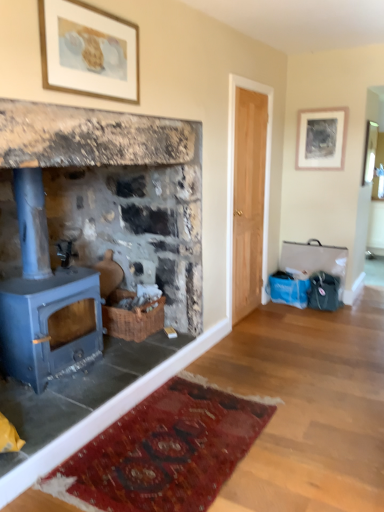
Looking at this image, what is the approximate height of matte silver picture frame at upper right, the 2th picture frame positioned from the front?

The height of matte silver picture frame at upper right, the 2th picture frame positioned from the front, is 55.64 centimeters.

Locate an element on the screen. This screenshot has width=384, height=512. blue painted wood stove at left is located at coordinates (94, 262).

Identify the location of matte blue wood burning stove at left. This screenshot has height=512, width=384. (46, 300).

Describe the element at coordinates (88, 51) in the screenshot. This screenshot has height=512, width=384. I see `gold-framed artwork at upper center, placed as the second picture frame when sorted from right to left` at that location.

Where is `matte silver picture frame at upper right, which is the 1th picture frame in back-to-front order`? This screenshot has height=512, width=384. matte silver picture frame at upper right, which is the 1th picture frame in back-to-front order is located at coordinates (321, 139).

From a real-world perspective, is matte silver picture frame at upper right, which is the 1th picture frame in back-to-front order, located beneath blue painted wood stove at left?

No, from a real-world perspective, matte silver picture frame at upper right, which is the 1th picture frame in back-to-front order, is not below blue painted wood stove at left.

Looking at this image, between matte silver picture frame at upper right, the first picture frame positioned from the right, and blue painted wood stove at left, which one is positioned in front?

blue painted wood stove at left is in front.

Considering the relative sizes of matte silver picture frame at upper right, which is the 1th picture frame in back-to-front order, and blue painted wood stove at left in the image provided, is matte silver picture frame at upper right, which is the 1th picture frame in back-to-front order, bigger than blue painted wood stove at left?

No, matte silver picture frame at upper right, which is the 1th picture frame in back-to-front order, is not bigger than blue painted wood stove at left.

Is matte silver picture frame at upper right, the second picture frame viewed from the left, taller or shorter than blue painted wood stove at left?

Considering their sizes, matte silver picture frame at upper right, the second picture frame viewed from the left, has less height than blue painted wood stove at left.

How different are the orientations of gold-framed artwork at upper center, which is counted as the 1th picture frame, starting from the left, and blue painted wood stove at left in degrees?

The facing directions of gold-framed artwork at upper center, which is counted as the 1th picture frame, starting from the left, and blue painted wood stove at left are 1.1 degrees apart.

Considering the sizes of objects gold-framed artwork at upper center, which is the 2th picture frame from back to front, and blue painted wood stove at left in the image provided, who is smaller, gold-framed artwork at upper center, which is the 2th picture frame from back to front, or blue painted wood stove at left?

gold-framed artwork at upper center, which is the 2th picture frame from back to front, is smaller.

From the image's perspective, is gold-framed artwork at upper center, placed as the second picture frame when sorted from right to left, positioned above or below blue painted wood stove at left?

gold-framed artwork at upper center, placed as the second picture frame when sorted from right to left, is above blue painted wood stove at left.

Is matte silver picture frame at upper right, the first picture frame positioned from the right, looking in the opposite direction of matte blue wood burning stove at left?

matte silver picture frame at upper right, the first picture frame positioned from the right, is not turned away from matte blue wood burning stove at left.

From the image's perspective, is matte silver picture frame at upper right, the second picture frame viewed from the left, below matte blue wood burning stove at left?

No, from the image's perspective, matte silver picture frame at upper right, the second picture frame viewed from the left, is not beneath matte blue wood burning stove at left.

Is matte silver picture frame at upper right, which is the 1th picture frame in back-to-front order, next to matte blue wood burning stove at left?

No, matte silver picture frame at upper right, which is the 1th picture frame in back-to-front order, is not next to matte blue wood burning stove at left.

Consider the image. Considering the sizes of objects matte silver picture frame at upper right, the 2th picture frame positioned from the front, and matte blue wood burning stove at left in the image provided, who is smaller, matte silver picture frame at upper right, the 2th picture frame positioned from the front, or matte blue wood burning stove at left?

With smaller size is matte silver picture frame at upper right, the 2th picture frame positioned from the front.

Is blue painted wood stove at left far away from matte blue wood burning stove at left?

blue painted wood stove at left is actually quite close to matte blue wood burning stove at left.

Which is behind, point (151, 357) or point (92, 344)?

The point (151, 357) is farther.

At what (x,y) coordinates should I click in order to perform the action: click on wood burning stove on the left of blue painted wood stove at left. Please return your answer as a coordinate pair (x, y). Looking at the image, I should click on (46, 300).

How distant is blue painted wood stove at left from matte blue wood burning stove at left?

11.95 inches.

Looking at this image, which of these two, matte silver picture frame at upper right, the 2th picture frame positioned from the front, or gold-framed artwork at upper center, which is the 2th picture frame from back to front, stands shorter?

gold-framed artwork at upper center, which is the 2th picture frame from back to front, is shorter.

From a real-world perspective, which object rests below the other?

matte silver picture frame at upper right, the second picture frame viewed from the left, from a real-world perspective.

Between point (301, 169) and point (91, 92), which one is positioned behind?

The point (301, 169) is farther.

Measure the distance from matte silver picture frame at upper right, which is the 1th picture frame in back-to-front order, to gold-framed artwork at upper center, placed as the second picture frame when sorted from right to left.

8.20 feet.

Which is correct: gold-framed artwork at upper center, which is the 2th picture frame from back to front, is inside matte silver picture frame at upper right, the second picture frame viewed from the left, or outside of it?

gold-framed artwork at upper center, which is the 2th picture frame from back to front, exists outside the volume of matte silver picture frame at upper right, the second picture frame viewed from the left.

Consider the image. In terms of size, does gold-framed artwork at upper center, placed as the second picture frame when sorted from right to left, appear bigger or smaller than matte silver picture frame at upper right, the 2th picture frame positioned from the front?

In the image, gold-framed artwork at upper center, placed as the second picture frame when sorted from right to left, appears to be larger than matte silver picture frame at upper right, the 2th picture frame positioned from the front.

Between gold-framed artwork at upper center, arranged as the first picture frame when viewed from the front, and matte silver picture frame at upper right, which is the 1th picture frame in back-to-front order, which one appears on the right side from the viewer's perspective?

From the viewer's perspective, matte silver picture frame at upper right, which is the 1th picture frame in back-to-front order, appears more on the right side.

How much distance is there between gold-framed artwork at upper center, which is counted as the 1th picture frame, starting from the left, and matte silver picture frame at upper right, the second picture frame viewed from the left?

8.20 feet.

Which of these two, gold-framed artwork at upper center, placed as the second picture frame when sorted from right to left, or matte blue wood burning stove at left, stands shorter?

gold-framed artwork at upper center, placed as the second picture frame when sorted from right to left, is shorter.

Between gold-framed artwork at upper center, which is the 2th picture frame from back to front, and matte blue wood burning stove at left, which one appears on the right side from the viewer's perspective?

gold-framed artwork at upper center, which is the 2th picture frame from back to front, is more to the right.

From the image's perspective, which is above, gold-framed artwork at upper center, placed as the second picture frame when sorted from right to left, or matte blue wood burning stove at left?

gold-framed artwork at upper center, placed as the second picture frame when sorted from right to left, from the image's perspective.

Looking at this image, how far apart are gold-framed artwork at upper center, placed as the second picture frame when sorted from right to left, and matte blue wood burning stove at left?

gold-framed artwork at upper center, placed as the second picture frame when sorted from right to left, is 1.01 meters from matte blue wood burning stove at left.

From the blue painted wood stove at left, count 2nd picture frames backward and point to it. Please provide its 2D coordinates.

[(321, 139)]

Identify the location of fireplace to the left of gold-framed artwork at upper center, which is counted as the 1th picture frame, starting from the left. (94, 262).

When comparing their distances from gold-framed artwork at upper center, which is counted as the 1th picture frame, starting from the left, does matte blue wood burning stove at left or blue painted wood stove at left seem closer?

blue painted wood stove at left.

Which object lies nearer to the anchor point matte silver picture frame at upper right, the first picture frame positioned from the right, blue painted wood stove at left or gold-framed artwork at upper center, placed as the second picture frame when sorted from right to left?

blue painted wood stove at left is closer to matte silver picture frame at upper right, the first picture frame positioned from the right.

Based on their spatial positions, is gold-framed artwork at upper center, which is counted as the 1th picture frame, starting from the left, or matte silver picture frame at upper right, the 2th picture frame positioned from the front, further from matte blue wood burning stove at left?

Among the two, matte silver picture frame at upper right, the 2th picture frame positioned from the front, is located further to matte blue wood burning stove at left.

Based on their spatial positions, is matte silver picture frame at upper right, the 2th picture frame positioned from the front, or blue painted wood stove at left further from matte blue wood burning stove at left?

matte silver picture frame at upper right, the 2th picture frame positioned from the front.

Based on their spatial positions, is matte blue wood burning stove at left or matte silver picture frame at upper right, the first picture frame positioned from the right, further from gold-framed artwork at upper center, arranged as the first picture frame when viewed from the front?

matte silver picture frame at upper right, the first picture frame positioned from the right, is further to gold-framed artwork at upper center, arranged as the first picture frame when viewed from the front.

Based on their spatial positions, is gold-framed artwork at upper center, arranged as the first picture frame when viewed from the front, or blue painted wood stove at left closer to matte silver picture frame at upper right, the second picture frame viewed from the left?

Based on the image, blue painted wood stove at left appears to be nearer to matte silver picture frame at upper right, the second picture frame viewed from the left.

Looking at the image, which one is located further to gold-framed artwork at upper center, placed as the second picture frame when sorted from right to left, matte silver picture frame at upper right, the 2th picture frame positioned from the front, or matte blue wood burning stove at left?

The object further to gold-framed artwork at upper center, placed as the second picture frame when sorted from right to left, is matte silver picture frame at upper right, the 2th picture frame positioned from the front.

Considering their positions, is gold-framed artwork at upper center, placed as the second picture frame when sorted from right to left, positioned further to matte blue wood burning stove at left than blue painted wood stove at left?

gold-framed artwork at upper center, placed as the second picture frame when sorted from right to left.

Where is `fireplace between gold-framed artwork at upper center, arranged as the first picture frame when viewed from the front, and matte blue wood burning stove at left from top to bottom`? fireplace between gold-framed artwork at upper center, arranged as the first picture frame when viewed from the front, and matte blue wood burning stove at left from top to bottom is located at coordinates (94, 262).

Locate an element on the screen. This screenshot has width=384, height=512. picture frame between blue painted wood stove at left and matte silver picture frame at upper right, the first picture frame positioned from the right, from front to back is located at coordinates (88, 51).

The height and width of the screenshot is (512, 384). What are the coordinates of `wood burning stove located between gold-framed artwork at upper center, which is the 2th picture frame from back to front, and matte silver picture frame at upper right, the 2th picture frame positioned from the front, in the depth direction` in the screenshot? It's located at (46, 300).

Identify the location of wood burning stove between blue painted wood stove at left and matte silver picture frame at upper right, the 2th picture frame positioned from the front, from front to back. This screenshot has width=384, height=512. click(46, 300).